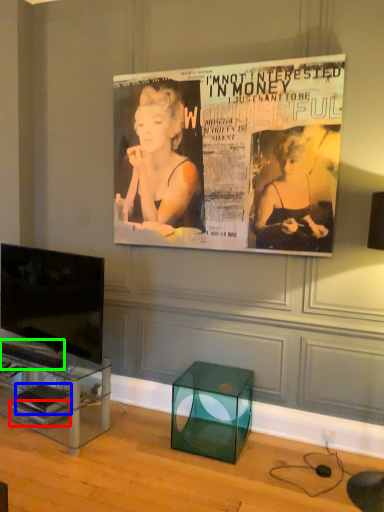
Question: Which object is the farthest from magazine (highlighted by a red box)? Choose among these: magazine (highlighted by a blue box) or magazine (highlighted by a green box).

Choices:
 (A) magazine
 (B) magazine

Answer: (B)